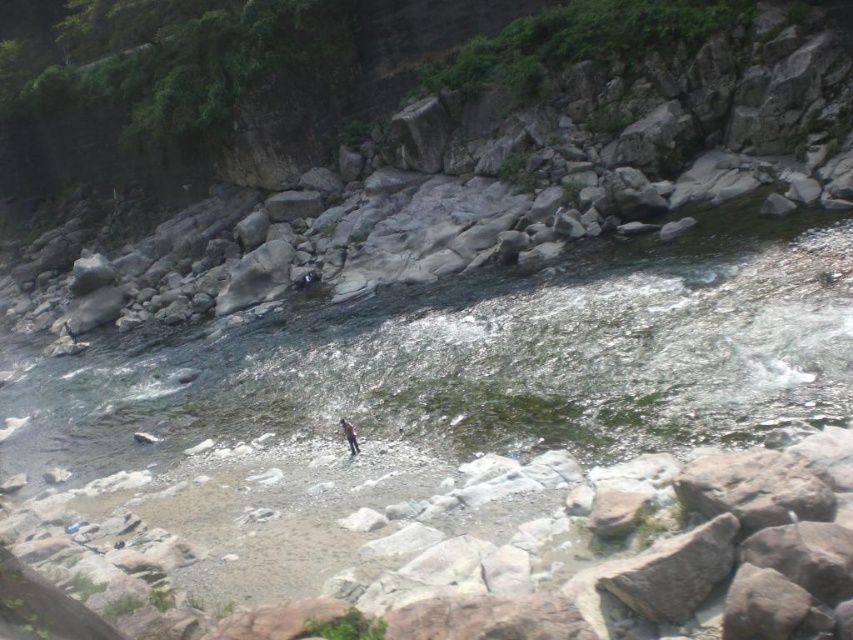
Question: Can you confirm if clear water at stream center is wider than dark gray fabric person at center?

Choices:
 (A) no
 (B) yes

Answer: (B)

Question: Does clear water at stream center appear on the right side of dark gray fabric person at center?

Choices:
 (A) yes
 (B) no

Answer: (B)

Question: Does clear water at stream center have a lesser width compared to dark gray fabric person at center?

Choices:
 (A) yes
 (B) no

Answer: (B)

Question: Which point is closer to the camera?

Choices:
 (A) clear water at stream center
 (B) dark gray fabric person at center

Answer: (A)